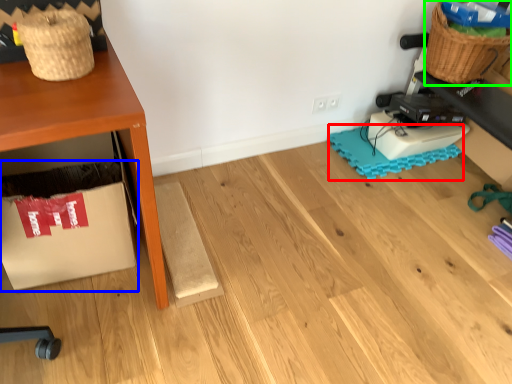
Question: Estimate the real-world distances between objects in this image. Which object is closer to mat (highlighted by a red box), cardboard box (highlighted by a blue box) or basket (highlighted by a green box)?

Choices:
 (A) cardboard box
 (B) basket

Answer: (B)